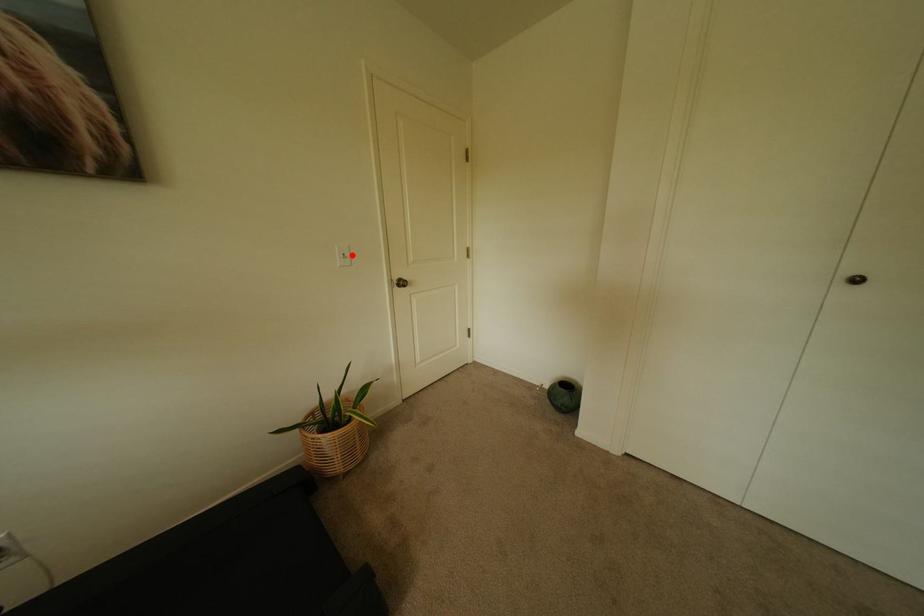
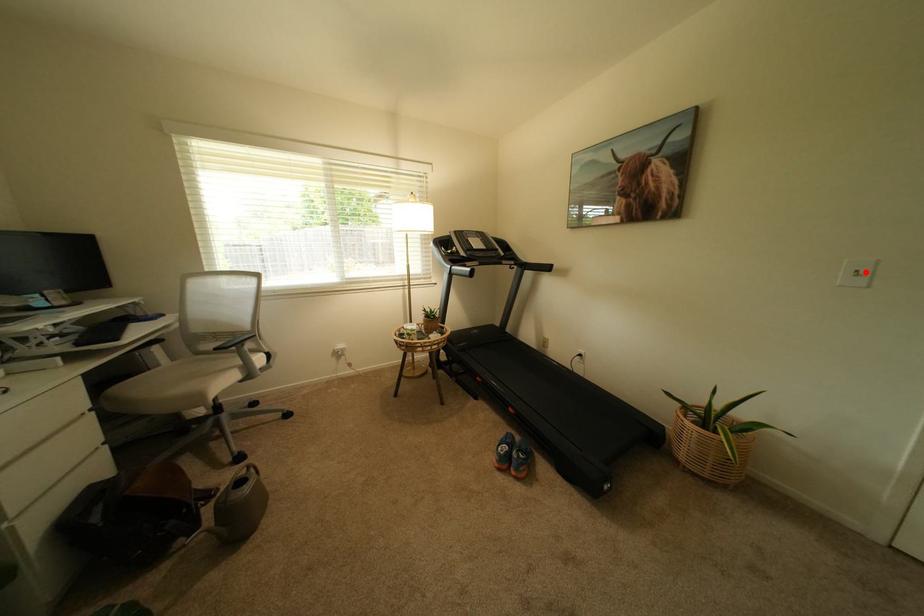
I am providing you with two images of the same scene from different viewpoints. A red point is marked on the first image and another point is marked on the second image. Do the highlighted points in image1 and image2 indicate the same real-world spot?

Yes